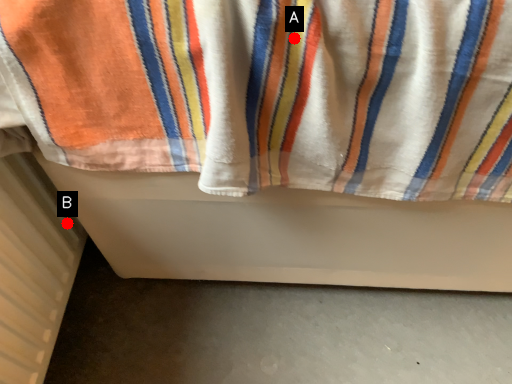
Question: Two points are circled on the image, labeled by A and B beside each circle. Which point is closer to the camera?

Choices:
 (A) A is closer
 (B) B is closer

Answer: (A)